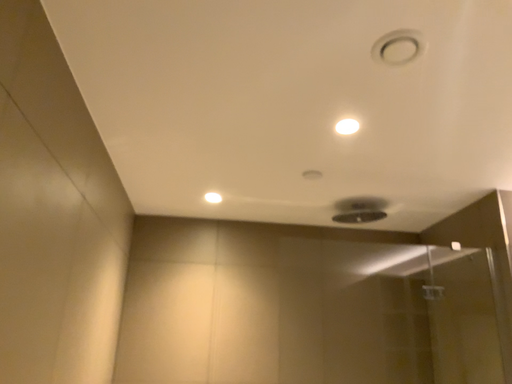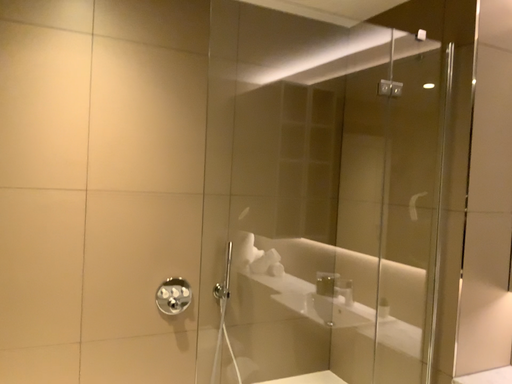
Question: Which way did the camera rotate in the video?

Choices:
 (A) rotated downward
 (B) rotated upward

Answer: (A)